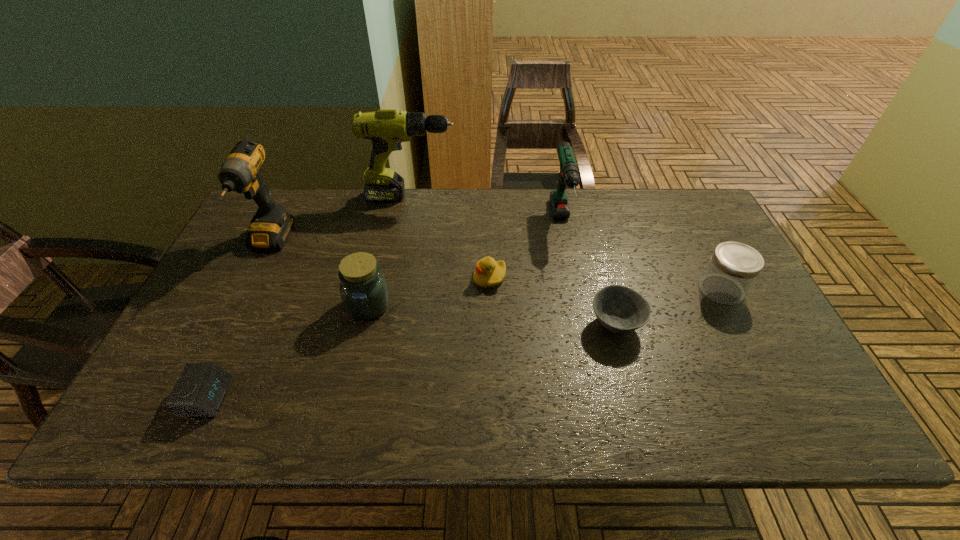
You are a GUI agent. You are given a task and a screenshot of the screen. Output one action in this format:
    pyautogui.click(x=<x>, y=<y>)
    Task: Click on the alarm clock
    The width and height of the screenshot is (960, 540).
    Given the screenshot: What is the action you would take?
    pyautogui.click(x=200, y=390)

Where is `vacant space located 0.240m on the handle side of the second drill from left to right`? vacant space located 0.240m on the handle side of the second drill from left to right is located at coordinates (528, 197).

Identify the location of vacant region located with the drill bit of the leftmost drill facing forward. (207, 368).

Locate an element on the screen. vacant position located 0.120m on the handle side of the sixth shortest object is located at coordinates (573, 280).

I want to click on free spot located on the right of the taller jar, so click(x=488, y=305).

I want to click on vacant space situated 0.230m on the front of the shorter jar, so pos(770,385).

Where is `free region located 0.280m on the beak of the fourth object from right to left`? This screenshot has width=960, height=540. free region located 0.280m on the beak of the fourth object from right to left is located at coordinates (372, 278).

You are a GUI agent. You are given a task and a screenshot of the screen. Output one action in this format:
    pyautogui.click(x=<x>, y=<y>)
    Task: Click on the vacant point located on the beak of the fourth object from right to left
    The width and height of the screenshot is (960, 540).
    Given the screenshot: What is the action you would take?
    pyautogui.click(x=339, y=278)

Locate an element on the screen. Image resolution: width=960 pixels, height=540 pixels. vacant space located on the beak of the fourth object from right to left is located at coordinates (390, 278).

Locate an element on the screen. This screenshot has width=960, height=540. vacant area situated 0.280m on the left of the bowl is located at coordinates (476, 325).